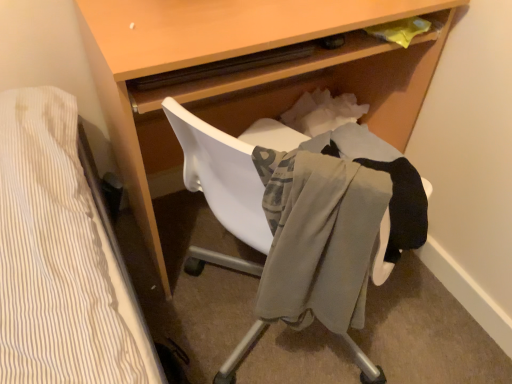
Question: Is light brown wood desk at center wider than light gray fabric at center?

Choices:
 (A) yes
 (B) no

Answer: (A)

Question: Is light brown wood desk at center turned away from light gray fabric at center?

Choices:
 (A) yes
 (B) no

Answer: (A)

Question: From a real-world perspective, is light brown wood desk at center over light gray fabric at center?

Choices:
 (A) no
 (B) yes

Answer: (A)

Question: Does light brown wood desk at center have a larger size compared to light gray fabric at center?

Choices:
 (A) yes
 (B) no

Answer: (A)

Question: Can light gray fabric at center be found inside light brown wood desk at center?

Choices:
 (A) no
 (B) yes

Answer: (A)

Question: Considering the relative positions of light brown wood desk at center and light gray fabric at center in the image provided, is light brown wood desk at center behind light gray fabric at center?

Choices:
 (A) yes
 (B) no

Answer: (B)

Question: From the image's perspective, is light gray fabric at center on light brown wood desk at center?

Choices:
 (A) no
 (B) yes

Answer: (A)

Question: Is light gray fabric at center at the right side of light brown wood desk at center?

Choices:
 (A) yes
 (B) no

Answer: (A)

Question: Would you say light gray fabric at center is a long distance from light brown wood desk at center?

Choices:
 (A) yes
 (B) no

Answer: (B)

Question: Is light gray fabric at center bigger than light brown wood desk at center?

Choices:
 (A) yes
 (B) no

Answer: (B)

Question: From a real-world perspective, is light gray fabric at center positioned over light brown wood desk at center based on gravity?

Choices:
 (A) no
 (B) yes

Answer: (B)

Question: Is light gray fabric at center oriented away from light brown wood desk at center?

Choices:
 (A) yes
 (B) no

Answer: (B)

Question: Is light gray fabric at center situated inside light brown wood desk at center or outside?

Choices:
 (A) outside
 (B) inside

Answer: (A)